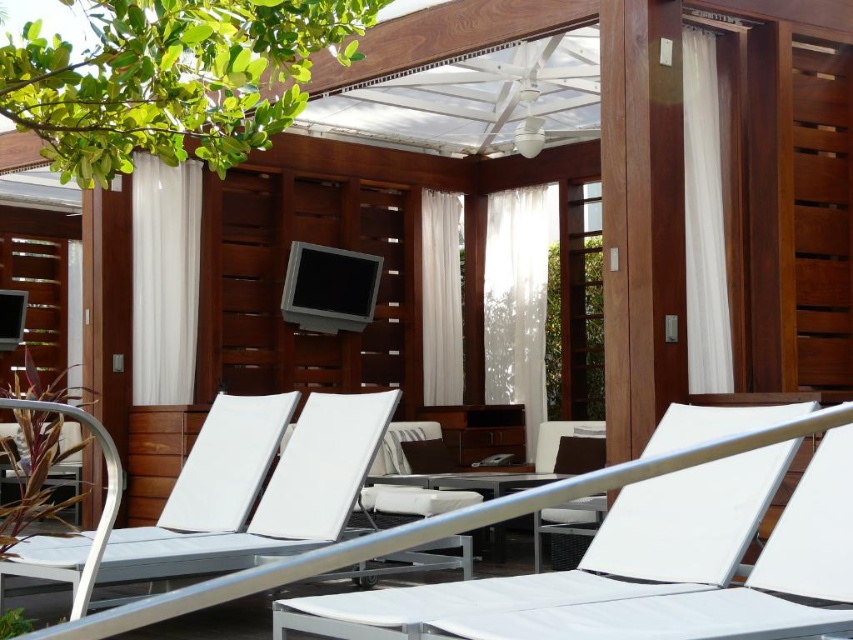
You are a delivery person trying to place a large potted plant between the white fabric chair at center and the white matte lounge chair at center. The plant requires at least 6 feet of space to be placed safely. Can you fit the plant between them?

The white fabric chair at center and the white matte lounge chair at center are 5.99 feet apart from each other. Since the required space is 6 feet, the plant cannot be placed safely between them as there is insufficient space.

You are sitting on the white matte lounge chair at center and want to move to the white fabric chair at center. Which direction should you move to reach it?

You should move to your right to reach the white fabric chair at center, as it is positioned to the right of the white matte lounge chair at center.

Consider the image. You are planning to place a tall potted plant in this lounge area. You have two options for placement locations. One is near the white fabric chair at center and the other is near the white matte lounge chair at center. Which location would allow the plant to be more visible to someone sitting in the other chair?

The white fabric chair at center is not as tall as the white matte lounge chair at center, so placing the plant near the white matte lounge chair at center would make it more visible to someone sitting in the white fabric chair at center.